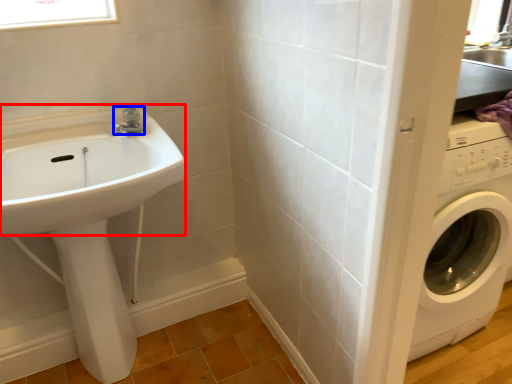
Question: Which of the following is the closest to the observer, sink (highlighted by a red box) or tap (highlighted by a blue box)?

Choices:
 (A) sink
 (B) tap

Answer: (A)